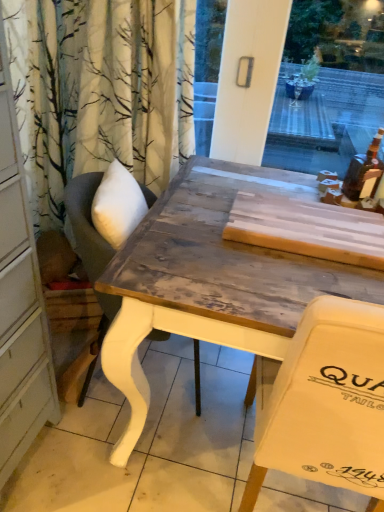
Find the location of a particular element. vacant space in front of wooden chair at center is located at coordinates (115, 467).